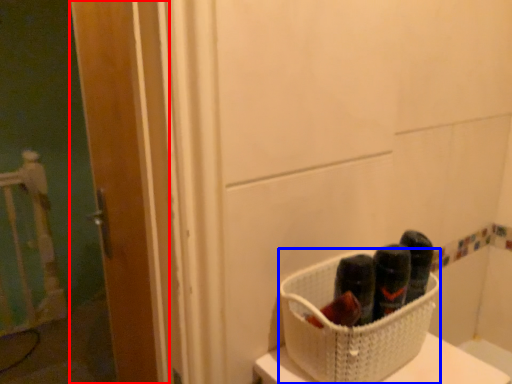
Question: Among these objects, which one is farthest to the camera, door (highlighted by a red box) or basket (highlighted by a blue box)?

Choices:
 (A) door
 (B) basket

Answer: (A)